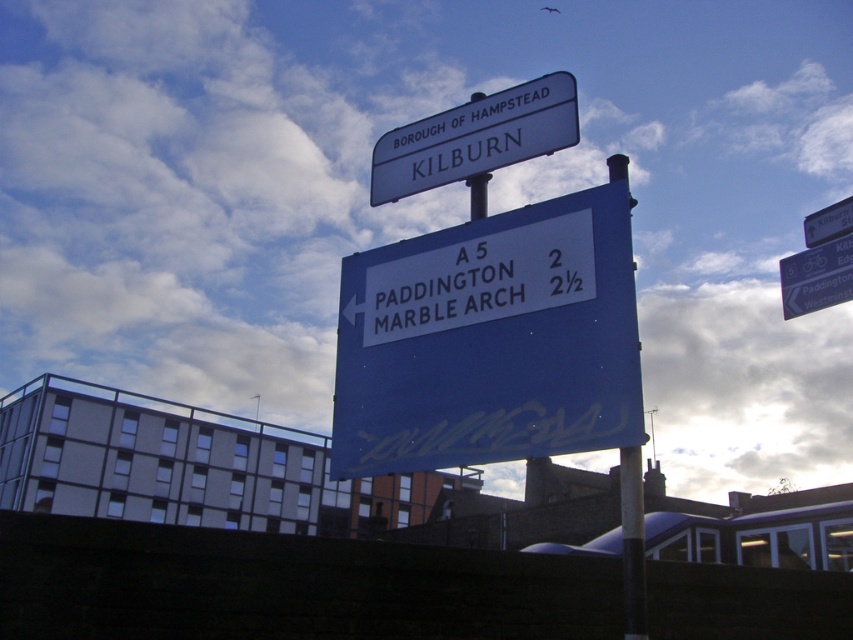
Question: Observing the image, what is the correct spatial positioning of blue painted metal sign at center in reference to metallic pole at center?

Choices:
 (A) below
 (B) above

Answer: (B)

Question: Is blue painted metal sign at center positioned at the back of white plastic sign at center?

Choices:
 (A) no
 (B) yes

Answer: (A)

Question: Among these objects, which one is farthest from the camera?

Choices:
 (A) white plastic sign at center
 (B) white plastic street sign at upper center
 (C) metallic pole at center
 (D) blue painted metal sign at center

Answer: (B)

Question: Which object is the farthest from the white plastic street sign at upper center?

Choices:
 (A) white plastic sign at center
 (B) blue painted metal sign at center
 (C) metallic pole at center

Answer: (C)

Question: Which point is closer to the camera?

Choices:
 (A) (389, 296)
 (B) (495, 145)

Answer: (A)

Question: Is blue painted metal sign at center bigger than metallic pole at center?

Choices:
 (A) yes
 (B) no

Answer: (B)